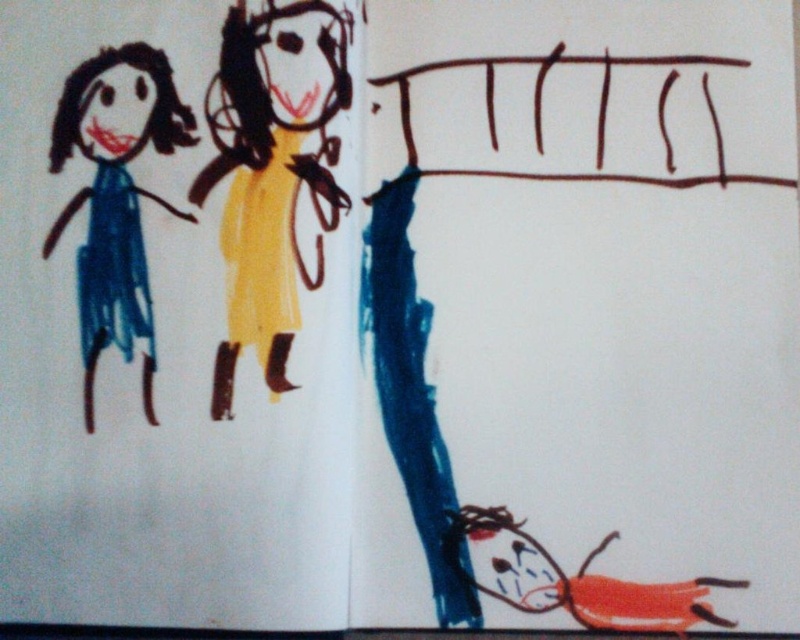
You are a child trying to place both dolls on a small shelf. The shelf can only hold items up to the width of the matte blue dress at left. Can the yellow paper doll at center fit on the shelf?

The yellow paper doll at center is wider than the matte blue dress at left, so it cannot fit on the shelf which can only hold items up to the width of the matte blue dress at left.

You are holding a 36 inch long pole. You see a point at coordinates point (340, 32). Can you reach it with your pole?

The point (340, 32) is 34.97 inches from camera, so yes, the pole can reach it since it is shorter than the pole length.